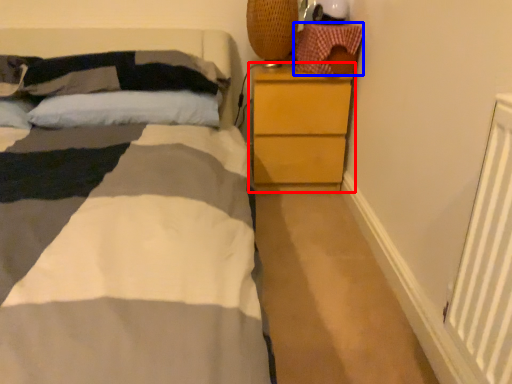
Question: Which of the following is the farthest to the observer, chest of drawers (highlighted by a red box) or material (highlighted by a blue box)?

Choices:
 (A) chest of drawers
 (B) material

Answer: (A)